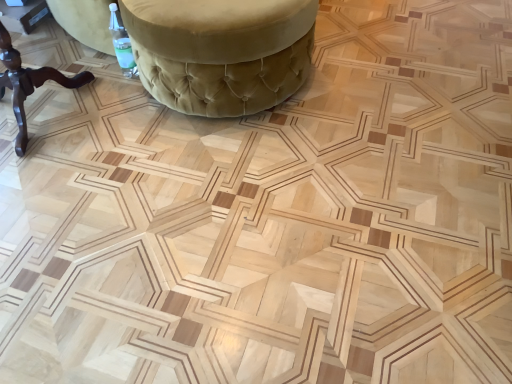
Locate an element on the screen. Image resolution: width=512 pixels, height=384 pixels. free space behind brown wooden table at left, the 1th furniture in the left-to-right sequence is located at coordinates point(65,53).